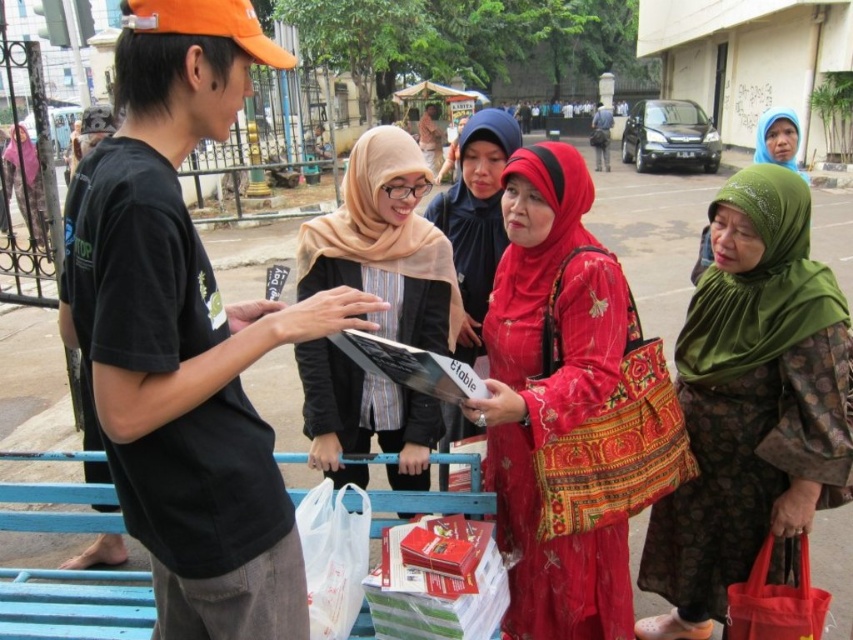
Question: Does green printed dress at right appear under matte red dress at center?

Choices:
 (A) no
 (B) yes

Answer: (B)

Question: Which point appears farthest from the camera in this image?

Choices:
 (A) (543, 228)
 (B) (848, 486)

Answer: (B)

Question: Estimate the real-world distances between objects in this image. Which object is farther from the matte beige scarf at center?

Choices:
 (A) matte red dress at center
 (B) green printed dress at right

Answer: (B)

Question: Can you confirm if green printed dress at right is bigger than matte beige scarf at center?

Choices:
 (A) yes
 (B) no

Answer: (B)

Question: Considering the real-world distances, which object is closest to the matte beige scarf at center?

Choices:
 (A) green printed dress at right
 (B) matte red dress at center

Answer: (B)

Question: Does green printed dress at right have a lesser width compared to matte red dress at center?

Choices:
 (A) no
 (B) yes

Answer: (B)